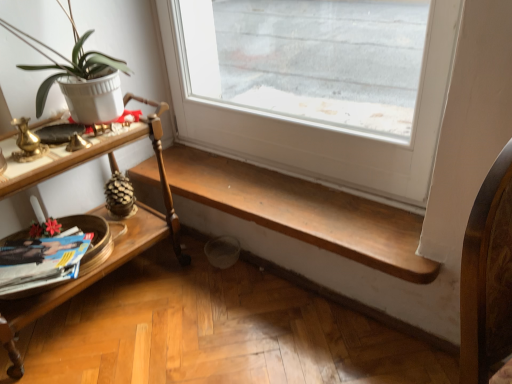
Question: Can you confirm if white matte pot at left is shorter than woodenmaterial/textureshelf at left?

Choices:
 (A) yes
 (B) no

Answer: (A)

Question: Is white matte pot at left not close to woodenmaterial/textureshelf at left?

Choices:
 (A) no
 (B) yes

Answer: (A)

Question: Can you confirm if white matte pot at left is smaller than woodenmaterial/textureshelf at left?

Choices:
 (A) no
 (B) yes

Answer: (B)

Question: Is woodenmaterial/textureshelf at left surrounded by white matte pot at left?

Choices:
 (A) no
 (B) yes

Answer: (A)

Question: Does white matte pot at left have a lesser width compared to woodenmaterial/textureshelf at left?

Choices:
 (A) yes
 (B) no

Answer: (A)

Question: Is point (360, 226) positioned closer to the camera than point (69, 162)?

Choices:
 (A) farther
 (B) closer

Answer: (A)

Question: From a real-world perspective, is wooden bench at lower center positioned above or below woodenmaterial/textureshelf at left?

Choices:
 (A) above
 (B) below

Answer: (B)

Question: Is wooden bench at lower center inside the boundaries of woodenmaterial/textureshelf at left, or outside?

Choices:
 (A) outside
 (B) inside

Answer: (A)

Question: Is wooden bench at lower center wider or thinner than woodenmaterial/textureshelf at left?

Choices:
 (A) wide
 (B) thin

Answer: (B)

Question: Do you think white matte pot at left is within wooden bench at lower center, or outside of it?

Choices:
 (A) inside
 (B) outside

Answer: (B)

Question: Is white matte pot at left in front of or behind wooden bench at lower center in the image?

Choices:
 (A) front
 (B) behind

Answer: (A)

Question: Is point (24, 69) closer or farther from the camera than point (303, 215)?

Choices:
 (A) closer
 (B) farther

Answer: (A)

Question: Is white matte pot at left bigger or smaller than wooden bench at lower center?

Choices:
 (A) small
 (B) big

Answer: (B)

Question: From a real-world perspective, is matte paper magazine at lower left positioned above or below white matte pot at left?

Choices:
 (A) below
 (B) above

Answer: (A)

Question: Considering their positions, is matte paper magazine at lower left located in front of or behind white matte pot at left?

Choices:
 (A) front
 (B) behind

Answer: (B)